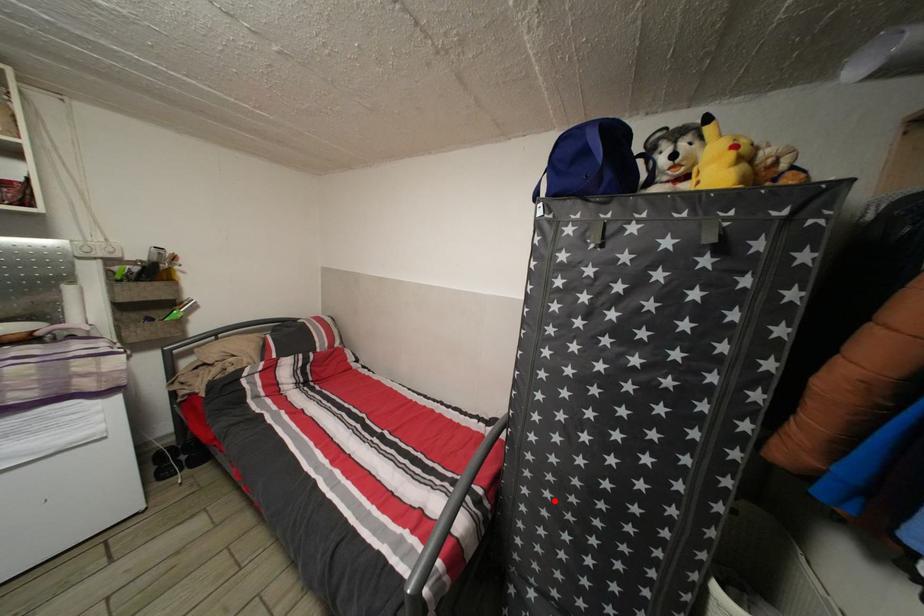
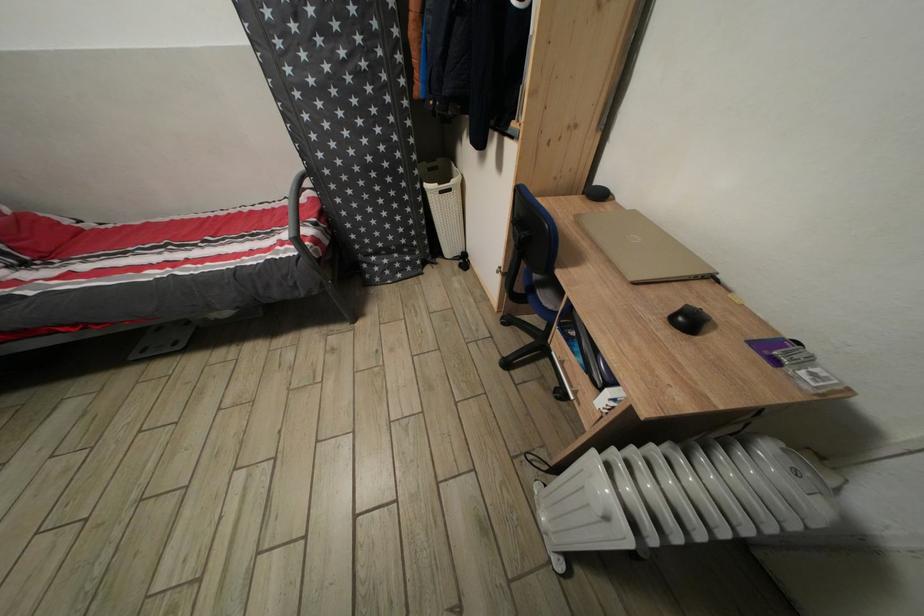
Question: I am providing you with two images of the same scene from different viewpoints. Given a red point in image1, look at the same physical point in image2. Is it:

Choices:
 (A) Closer to the viewpoint
 (B) Farther from the viewpoint

Answer: (A)